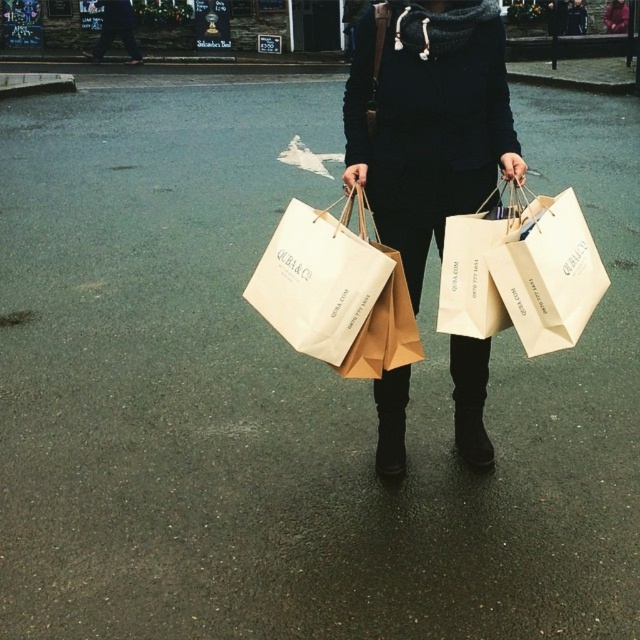
You are a delivery person who needs to hand over a package to the person in the image. The package is too large to fit in your hands. You must place it on the ground near the white paper bag at center and black suede boot at center. Which object should you place it closer to if you want it to be to the left of both objects?

You should place the package closer to the black suede boot at center because the white paper bag at center is already to the right of the black suede boot at center. Placing it near the boot would keep it to the left of both objects.

You are a delivery person who needs to place a matte white paper bag at center and a black suede boot at center into a storage box. The box can only fit items that are smaller than the boot. Will both items fit?

The matte white paper bag at center has a larger size compared to the black suede boot at center. Since the box can only fit items smaller than the boot, the matte white paper bag at center will not fit, but the black suede boot at center will fit into the box.

You are a delivery person who needs to place a new package on the exact location of the point marked at coordinates (336, 291). According to the scene, what object is currently occupying that spot?

The point at coordinates (336, 291) corresponds to the matte white paper bag at center, so the matte white paper bag at center is occupying that spot.